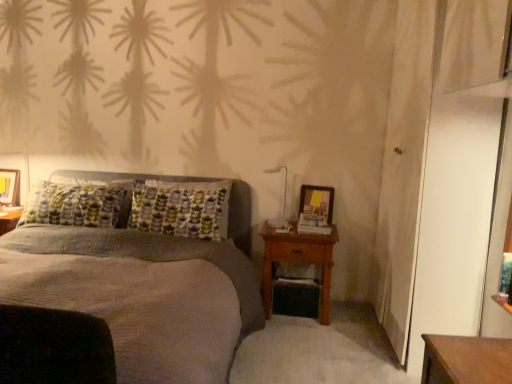
What is the approximate height of white glossy bedside lamp at upper right?

It is 18.17 inches.

Measure the distance between white glossy bedside lamp at upper right and camera.

white glossy bedside lamp at upper right and camera are 3.27 meters apart from each other.

Where is `matte wooden picture frame at right, which is counted as the second picture frame, starting from the left`? This screenshot has width=512, height=384. matte wooden picture frame at right, which is counted as the second picture frame, starting from the left is located at coordinates (316, 210).

What do you see at coordinates (298, 261) in the screenshot? I see `wooden nightstand at right` at bounding box center [298, 261].

Image resolution: width=512 pixels, height=384 pixels. What do you see at coordinates (146, 291) in the screenshot?
I see `textured gray bed at center` at bounding box center [146, 291].

Image resolution: width=512 pixels, height=384 pixels. I want to click on white glossy bedside lamp at upper right, so click(283, 202).

Could you measure the distance between wooden nightstand at right and matte wooden picture frame at left, acting as the first picture frame starting from the back?

wooden nightstand at right and matte wooden picture frame at left, acting as the first picture frame starting from the back, are 7.06 feet apart.

Looking at this image, from the image's perspective, which is below, wooden nightstand at right or matte wooden picture frame at left, acting as the first picture frame starting from the back?

From the image's view, wooden nightstand at right is below.

Is wooden nightstand at right smaller than matte wooden picture frame at left, acting as the first picture frame starting from the back?

Actually, wooden nightstand at right might be larger than matte wooden picture frame at left, acting as the first picture frame starting from the back.

From a real-world perspective, is wooden nightstand at right positioned over matte wooden picture frame at left, acting as the first picture frame starting from the back, based on gravity?

No, from a real-world perspective, wooden nightstand at right is not on top of matte wooden picture frame at left, acting as the first picture frame starting from the back.

Visually, is textured gray bed at center positioned to the left or to the right of matte wooden picture frame at right, which ranks as the 1th picture frame in front-to-back order?

Clearly, textured gray bed at center is on the left of matte wooden picture frame at right, which ranks as the 1th picture frame in front-to-back order, in the image.

Locate an element on the screen. The width and height of the screenshot is (512, 384). bed on the left of matte wooden picture frame at right, acting as the first picture frame starting from the right is located at coordinates (146, 291).

Considering the sizes of textured gray bed at center and matte wooden picture frame at right, acting as the first picture frame starting from the right, in the image, is textured gray bed at center bigger or smaller than matte wooden picture frame at right, acting as the first picture frame starting from the right,?

In the image, textured gray bed at center appears to be larger than matte wooden picture frame at right, acting as the first picture frame starting from the right.

In the image, is textured gray bed at center positioned in front of or behind matte wooden picture frame at right, which ranks as the 1th picture frame in front-to-back order?

textured gray bed at center is positioned closer to the viewer than matte wooden picture frame at right, which ranks as the 1th picture frame in front-to-back order.

Can you confirm if matte wooden picture frame at right, the 2th picture frame viewed from the back, is smaller than white glossy bedside lamp at upper right?

Correct, matte wooden picture frame at right, the 2th picture frame viewed from the back, occupies less space than white glossy bedside lamp at upper right.

From the image's perspective, which one is positioned higher, matte wooden picture frame at right, acting as the first picture frame starting from the right, or white glossy bedside lamp at upper right?

white glossy bedside lamp at upper right, from the image's perspective.

Which is behind, point (325, 203) or point (285, 168)?

The point (285, 168) is farther from the camera.

Considering the positions of objects white glossy bedside lamp at upper right and matte wooden picture frame at right, the 2th picture frame viewed from the back, in the image provided, who is more to the right, white glossy bedside lamp at upper right or matte wooden picture frame at right, the 2th picture frame viewed from the back,?

matte wooden picture frame at right, the 2th picture frame viewed from the back.

Is matte wooden picture frame at right, which ranks as the 1th picture frame in front-to-back order, at the back of white glossy bedside lamp at upper right?

No, white glossy bedside lamp at upper right is not facing the opposite direction of matte wooden picture frame at right, which ranks as the 1th picture frame in front-to-back order.

Is white glossy bedside lamp at upper right wider than matte wooden picture frame at right, the 2th picture frame viewed from the back?

Yes.

Is there a large distance between matte wooden picture frame at left, which ranks as the 2th picture frame in front-to-back order, and white glossy bedside lamp at upper right?

Yes, matte wooden picture frame at left, which ranks as the 2th picture frame in front-to-back order, and white glossy bedside lamp at upper right are located far from each other.

In the scene shown: From a real-world perspective, is matte wooden picture frame at left, marked as the first picture frame in a left-to-right arrangement, under white glossy bedside lamp at upper right?

Yes, from a real-world perspective, matte wooden picture frame at left, marked as the first picture frame in a left-to-right arrangement, is beneath white glossy bedside lamp at upper right.

Considering the points (17, 202) and (283, 223), which point is behind, point (17, 202) or point (283, 223)?

The point (283, 223) is more distant.

In terms of width, does matte wooden picture frame at left, acting as the first picture frame starting from the back, look wider or thinner when compared to white glossy bedside lamp at upper right?

In the image, matte wooden picture frame at left, acting as the first picture frame starting from the back, appears to be more narrow than white glossy bedside lamp at upper right.

Does white glossy bedside lamp at upper right have a greater width compared to matte wooden picture frame at left, placed as the 2th picture frame when sorted from right to left?

Yes, white glossy bedside lamp at upper right is wider than matte wooden picture frame at left, placed as the 2th picture frame when sorted from right to left.

Where is `bedside lamp on the right of matte wooden picture frame at left, marked as the first picture frame in a left-to-right arrangement`? bedside lamp on the right of matte wooden picture frame at left, marked as the first picture frame in a left-to-right arrangement is located at coordinates (283, 202).

Is white glossy bedside lamp at upper right to the right of matte wooden picture frame at left, marked as the first picture frame in a left-to-right arrangement, from the viewer's perspective?

Yes, white glossy bedside lamp at upper right is to the right of matte wooden picture frame at left, marked as the first picture frame in a left-to-right arrangement.

Can you tell me how much white glossy bedside lamp at upper right and matte wooden picture frame at left, which ranks as the 2th picture frame in front-to-back order, differ in facing direction?

There is a 15.5-degree angle between the facing directions of white glossy bedside lamp at upper right and matte wooden picture frame at left, which ranks as the 2th picture frame in front-to-back order.

In order to click on bed in front of the wooden nightstand at right in this screenshot , I will do `click(146, 291)`.

Consider the image. From the image's perspective, is textured gray bed at center located above wooden nightstand at right?

Yes, from the image's perspective, textured gray bed at center is above wooden nightstand at right.

In the scene shown: Would you say wooden nightstand at right is part of textured gray bed at center's contents?

Yes, wooden nightstand at right can be found within textured gray bed at center.

Considering the relative sizes of textured gray bed at center and wooden nightstand at right in the image provided, is textured gray bed at center taller than wooden nightstand at right?

Correct, textured gray bed at center is much taller as wooden nightstand at right.

Where is `nightstand lying below the matte wooden picture frame at left, placed as the 2th picture frame when sorted from right to left (from the image's perspective)`? Image resolution: width=512 pixels, height=384 pixels. nightstand lying below the matte wooden picture frame at left, placed as the 2th picture frame when sorted from right to left (from the image's perspective) is located at coordinates pyautogui.click(x=298, y=261).

Locate an element on the screen. The image size is (512, 384). picture frame on the right of textured gray bed at center is located at coordinates (x=316, y=210).

Looking at the image, which one is located closer to wooden nightstand at right, textured gray bed at center or white glossy bedside lamp at upper right?

Among the two, white glossy bedside lamp at upper right is located nearer to wooden nightstand at right.

In the scene shown: Considering their positions, is matte wooden picture frame at left, placed as the 2th picture frame when sorted from right to left, positioned further to white glossy bedside lamp at upper right than wooden nightstand at right?

Among the two, matte wooden picture frame at left, placed as the 2th picture frame when sorted from right to left, is located further to white glossy bedside lamp at upper right.

Looking at the image, which one is located further to textured gray bed at center, matte wooden picture frame at right, acting as the first picture frame starting from the right, or white glossy bedside lamp at upper right?

white glossy bedside lamp at upper right is positioned further to the anchor textured gray bed at center.

Which object lies nearer to the anchor point wooden nightstand at right, matte wooden picture frame at left, which ranks as the 2th picture frame in front-to-back order, or white glossy bedside lamp at upper right?

The object closer to wooden nightstand at right is white glossy bedside lamp at upper right.

Estimate the real-world distances between objects in this image. Which object is closer to matte wooden picture frame at right, which is counted as the second picture frame, starting from the left, textured gray bed at center or wooden nightstand at right?

The object closer to matte wooden picture frame at right, which is counted as the second picture frame, starting from the left, is wooden nightstand at right.

When comparing their distances from textured gray bed at center, does wooden nightstand at right or matte wooden picture frame at right, acting as the first picture frame starting from the right, seem further?

matte wooden picture frame at right, acting as the first picture frame starting from the right, is positioned further to the anchor textured gray bed at center.

Considering their positions, is matte wooden picture frame at left, acting as the first picture frame starting from the back, positioned further to white glossy bedside lamp at upper right than matte wooden picture frame at right, the 2th picture frame viewed from the back?

matte wooden picture frame at left, acting as the first picture frame starting from the back, lies further to white glossy bedside lamp at upper right than the other object.

Considering their positions, is matte wooden picture frame at left, placed as the 2th picture frame when sorted from right to left, positioned further to white glossy bedside lamp at upper right than textured gray bed at center?

matte wooden picture frame at left, placed as the 2th picture frame when sorted from right to left.

Where is `nightstand positioned between textured gray bed at center and matte wooden picture frame at right, which ranks as the 1th picture frame in front-to-back order, from near to far`? nightstand positioned between textured gray bed at center and matte wooden picture frame at right, which ranks as the 1th picture frame in front-to-back order, from near to far is located at coordinates (298, 261).

This screenshot has width=512, height=384. What are the coordinates of `nightstand located between matte wooden picture frame at left, acting as the first picture frame starting from the back, and matte wooden picture frame at right, which ranks as the 1th picture frame in front-to-back order, in the left-right direction` in the screenshot? It's located at (298, 261).

Identify the location of picture frame between white glossy bedside lamp at upper right and wooden nightstand at right in the vertical direction. (316, 210).

Locate an element on the screen. bedside lamp between textured gray bed at center and wooden nightstand at right in the front-back direction is located at coordinates (283, 202).